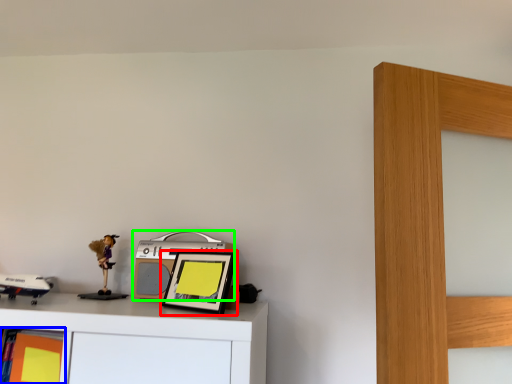
Question: Based on their relative distances, which object is nearer to picture frame (highlighted by a red box)? Choose from shelf (highlighted by a blue box) and stereo (highlighted by a green box).

Choices:
 (A) shelf
 (B) stereo

Answer: (B)